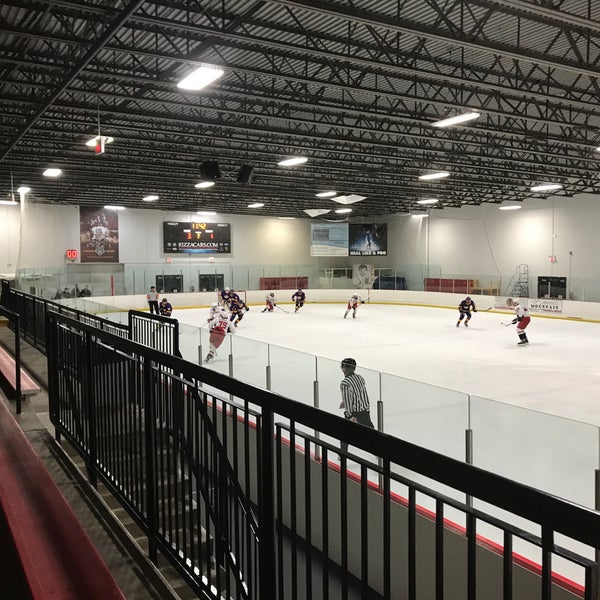
Find the location of a particular element. This screenshot has height=600, width=600. lighting is located at coordinates (199, 80), (352, 197).